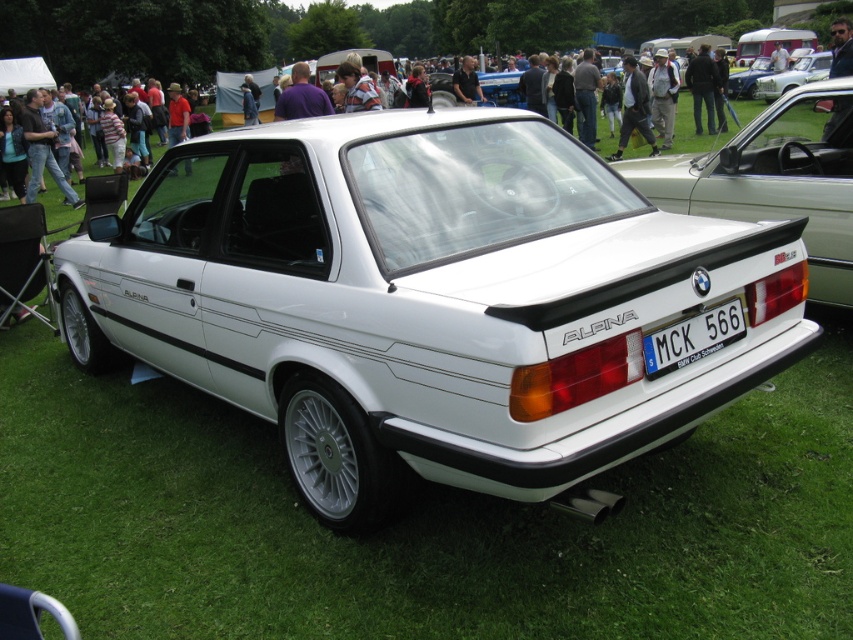
You are standing near the white metallic car at center at an outdoor car show. If you want to take a photo of the car without anyone blocking the view, which direction should you move to ensure you have a clear shot?

Since the white metallic car at center is 7.66 feet away from you, moving directly behind the car would likely give you an unobstructed view, as the crowd is in the foreground closer to your current position.

You are a photographer at the car show and want to capture both the white metallic car at center and the white glossy sedan at upper right in a single frame. Given their sizes, which car should you position closer to the camera to ensure both appear balanced in size in your photo?

To balance the size of both cars in the photo, you should position the white glossy sedan at upper right closer to the camera since it is smaller than the white metallic car at center. This way, the smaller sedan will appear larger in the frame, matching the size of the larger metallic car.

You are at a car show and see the white glossy sedan at upper right and the white plastic license plate at rear. Which object is positioned to the left of the other?

The white plastic license plate at rear is positioned to the left of the white glossy sedan at upper right.